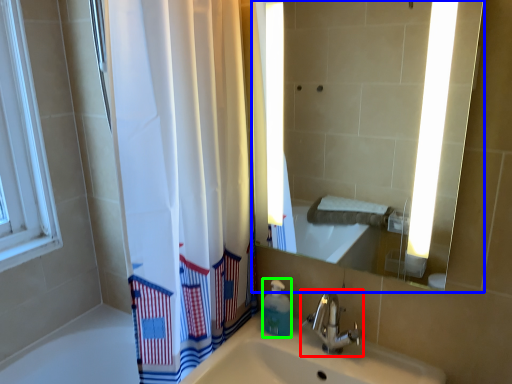
Question: Estimate the real-world distances between objects in this image. Which object is closer to tap (highlighted by a red box), mirror (highlighted by a blue box) or soap dispenser (highlighted by a green box)?

Choices:
 (A) mirror
 (B) soap dispenser

Answer: (B)